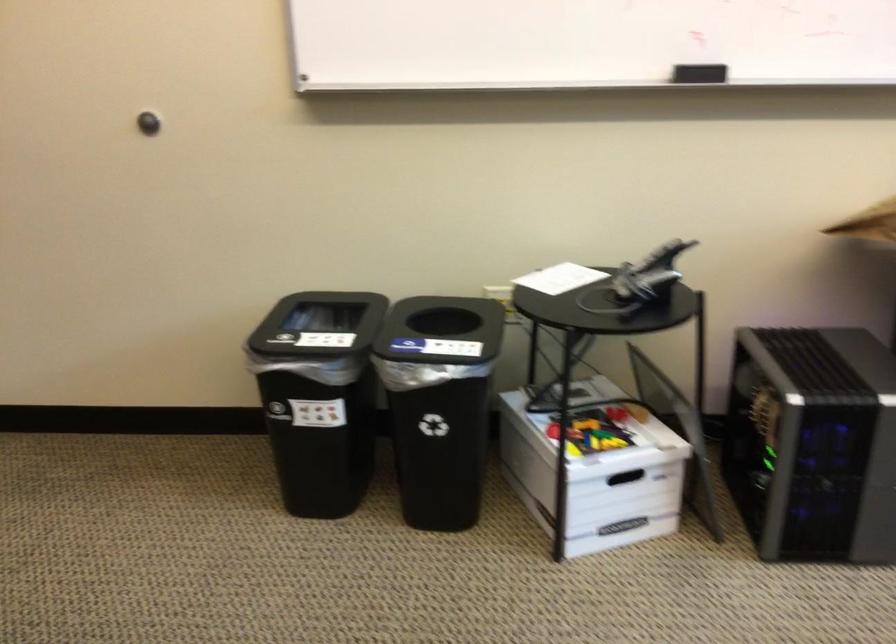
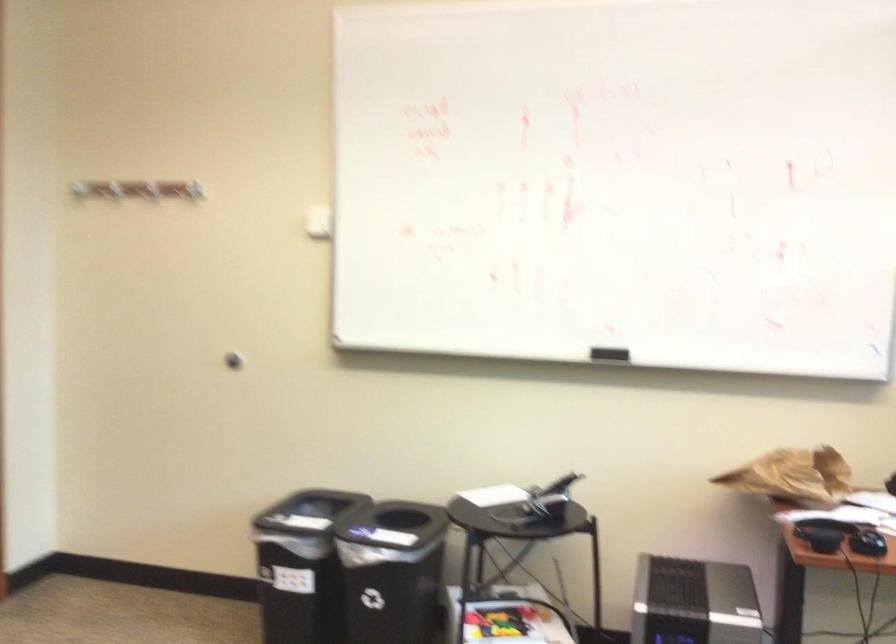
Find the pixel in the second image that matches point 640,281 in the first image.

(539, 503)